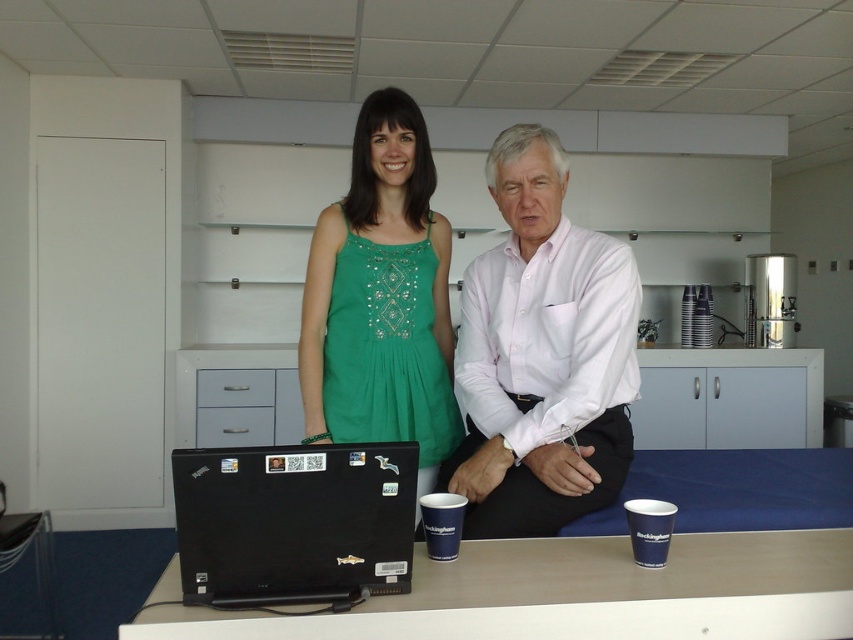
Can you confirm if white cotton shirt at center is positioned below green embroidered dress at center?

Correct, white cotton shirt at center is located below green embroidered dress at center.

Which is in front, point (556, 212) or point (314, 344)?

Point (556, 212) is in front.

I want to click on white cotton shirt at center, so click(541, 355).

Does point (552, 314) come farther from viewer compared to point (364, 448)?

Yes.

What do you see at coordinates (541, 355) in the screenshot?
I see `white cotton shirt at center` at bounding box center [541, 355].

The height and width of the screenshot is (640, 853). Identify the location of white cotton shirt at center. (541, 355).

Which is more to the left, white cotton shirt at center or black plastic laptop at center?

black plastic laptop at center

Between white cotton shirt at center and black plastic laptop at center, which one has less height?

With less height is black plastic laptop at center.

What do you see at coordinates (541, 355) in the screenshot? This screenshot has height=640, width=853. I see `white cotton shirt at center` at bounding box center [541, 355].

Locate an element on the screen. white cotton shirt at center is located at coordinates pos(541,355).